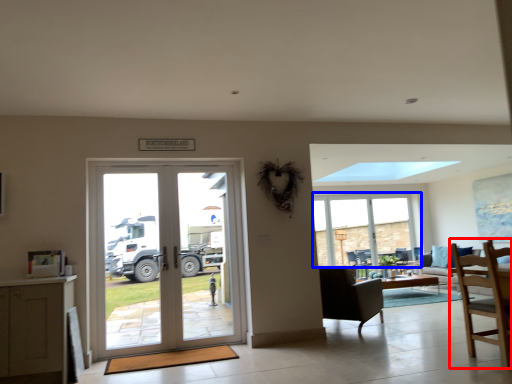
Question: Which object appears farthest to the camera in this image, chair (highlighted by a red box) or window (highlighted by a blue box)?

Choices:
 (A) chair
 (B) window

Answer: (B)